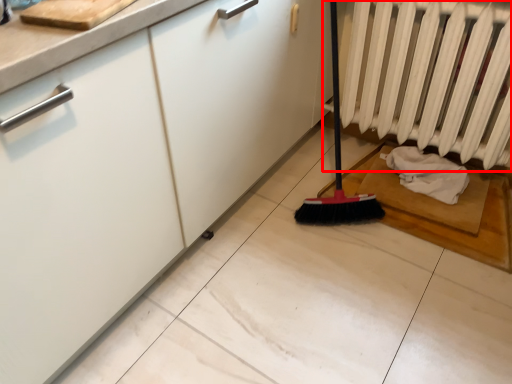
Question: Observing the image, what is the correct spatial positioning of radiator (annotated by the red box) in reference to material?

Choices:
 (A) left
 (B) right

Answer: (A)